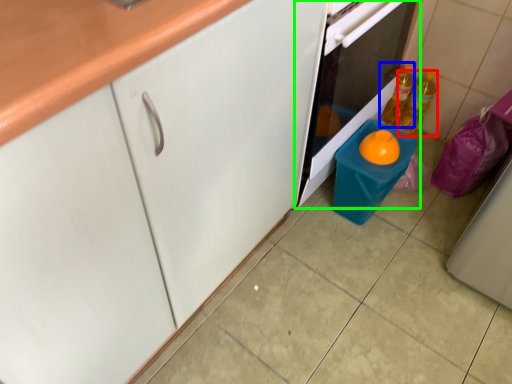
Question: Estimate the real-world distances between objects in this image. Which object is closer to bottle (highlighted by a red box), bottle (highlighted by a blue box) or home appliance (highlighted by a green box)?

Choices:
 (A) bottle
 (B) home appliance

Answer: (A)